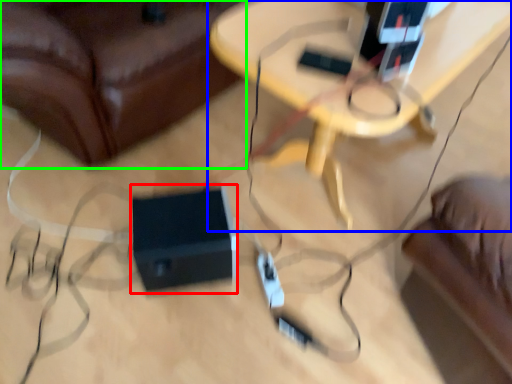
Question: Which object is positioned farthest from speaker (highlighted by a red box)? Select from table (highlighted by a blue box) and furniture (highlighted by a green box).

Choices:
 (A) table
 (B) furniture

Answer: (A)